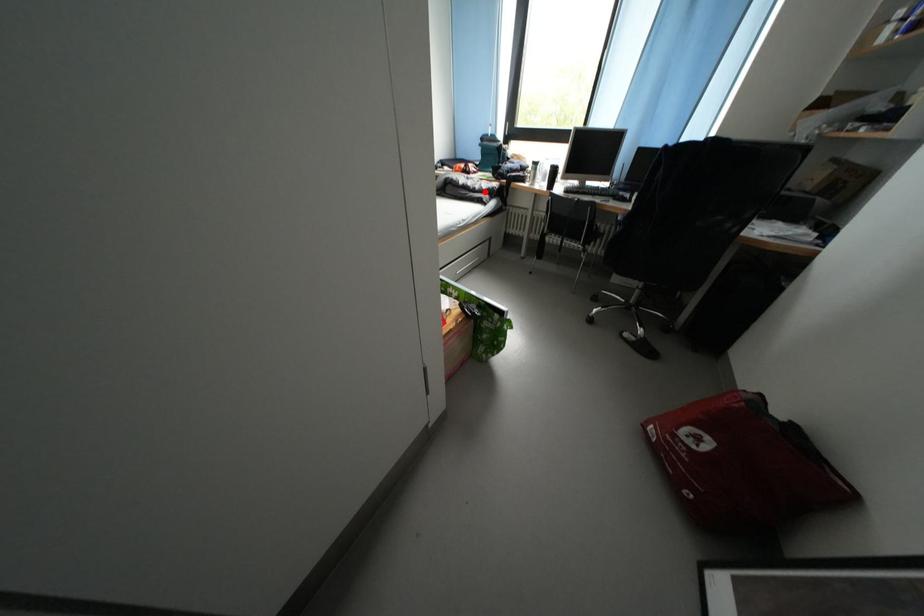
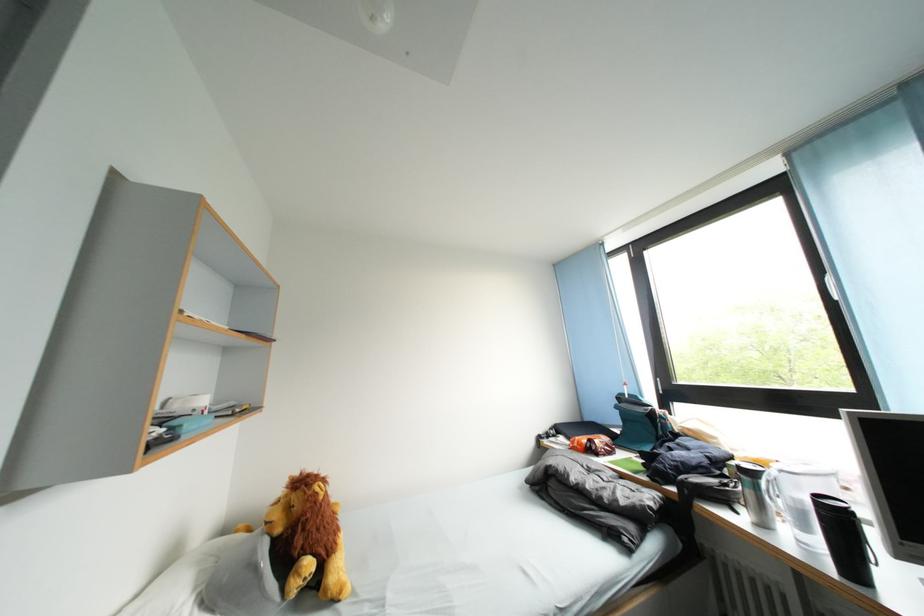
The point at the highlighted location is marked in the first image. Where is the corresponding point in the second image?

(614, 501)